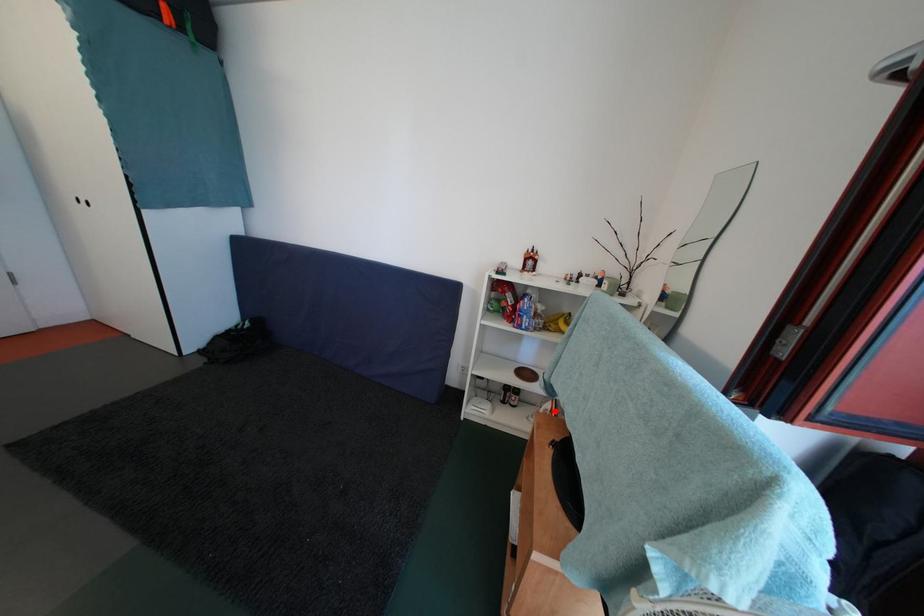
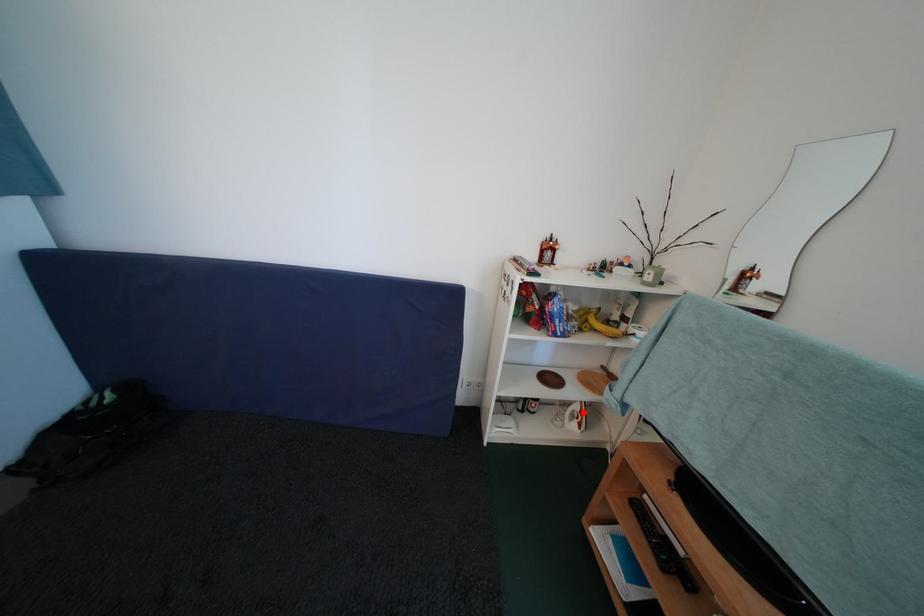
I am providing you with two images of the same scene from different viewpoints. A red point is marked on the first image and another point is marked on the second image. Is the red point in image1 aligned with the point shown in image2?

Yes